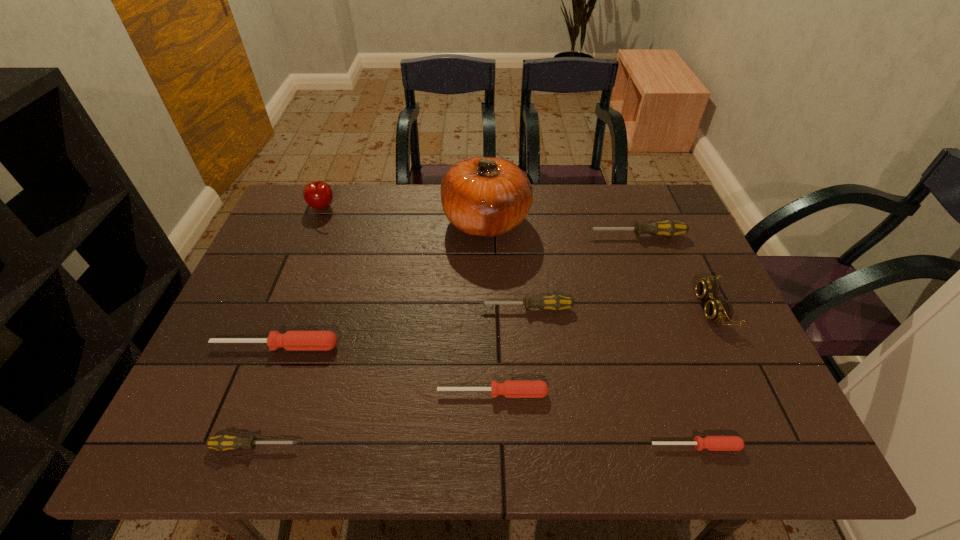
Where is `orange pumpkin`? The height and width of the screenshot is (540, 960). orange pumpkin is located at coordinates (481, 196).

The image size is (960, 540). I want to click on pumpkin, so click(481, 196).

At what (x,y) coordinates should I click in order to perform the action: click on cherry. Please return your answer as a coordinate pair (x, y). The image size is (960, 540). Looking at the image, I should click on (x=318, y=194).

This screenshot has width=960, height=540. I want to click on goggles, so coord(719,310).

This screenshot has height=540, width=960. Find the location of `the farthest gray screwdriver`. the farthest gray screwdriver is located at coordinates (669, 228).

The image size is (960, 540). Find the location of `the farthest screwdriver`. the farthest screwdriver is located at coordinates (669, 228).

Locate an element on the screen. the second gray screwdriver from left to right is located at coordinates (555, 302).

At what (x,y) coordinates should I click in order to perform the action: click on the second farthest screwdriver. Please return your answer as a coordinate pair (x, y). This screenshot has height=540, width=960. Looking at the image, I should click on (555, 302).

Where is `the farthest red screwdriver`? Image resolution: width=960 pixels, height=540 pixels. the farthest red screwdriver is located at coordinates (292, 340).

At what (x,y) coordinates should I click in order to perform the action: click on the leftmost red screwdriver. Please return your answer as a coordinate pair (x, y). This screenshot has height=540, width=960. Looking at the image, I should click on (292, 340).